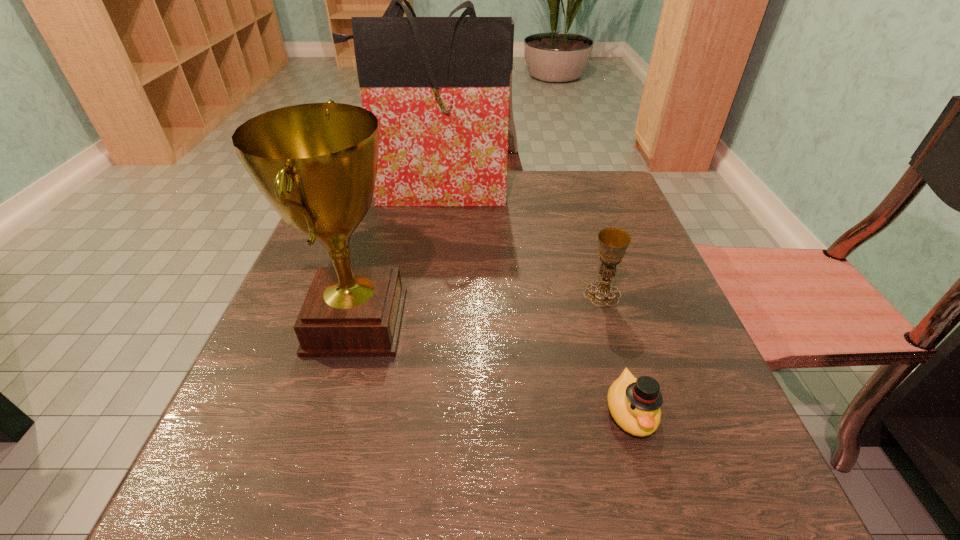
Identify the location of shopping bag that is at the left edge. (439, 86).

The height and width of the screenshot is (540, 960). Identify the location of award that is at the left edge. (316, 164).

At what (x,y) coordinates should I click in order to perform the action: click on chalice that is at the right edge. Please return your answer as a coordinate pair (x, y). This screenshot has height=540, width=960. Looking at the image, I should click on (613, 242).

Where is `duck located in the right edge section of the desktop`? This screenshot has height=540, width=960. duck located in the right edge section of the desktop is located at coordinates (634, 404).

In order to click on object present at the far left corner in this screenshot , I will do `click(439, 86)`.

You are a GUI agent. You are given a task and a screenshot of the screen. Output one action in this format:
    pyautogui.click(x=<x>, y=<y>)
    Task: Click on the free region at the far edge of the desktop
    
    Given the screenshot: What is the action you would take?
    pyautogui.click(x=531, y=219)

Identify the location of vacant space at the near edge. (511, 496).

In the image, there is a desktop. Where is `vacant space at the left edge`? vacant space at the left edge is located at coordinates (368, 228).

In the image, there is a desktop. Where is `vacant space at the right edge`? vacant space at the right edge is located at coordinates (591, 270).

The width and height of the screenshot is (960, 540). In the image, there is a desktop. What are the coordinates of `vacant space at the near left corner` in the screenshot? It's located at (270, 519).